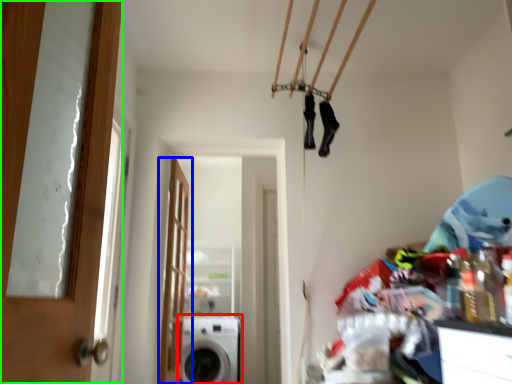
Question: Considering the real-world distances, which object is closest to washing machine (highlighted by a red box)? door (highlighted by a blue box) or door (highlighted by a green box).

Choices:
 (A) door
 (B) door

Answer: (A)